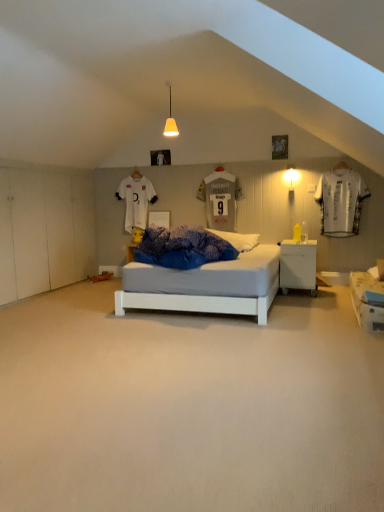
At what (x,y) coordinates should I click in order to perform the action: click on empty space that is ontop of matte yellow cone at upper center. Please return your answer as a coordinate pair (x, y). This screenshot has width=384, height=512. Looking at the image, I should click on (178, 80).